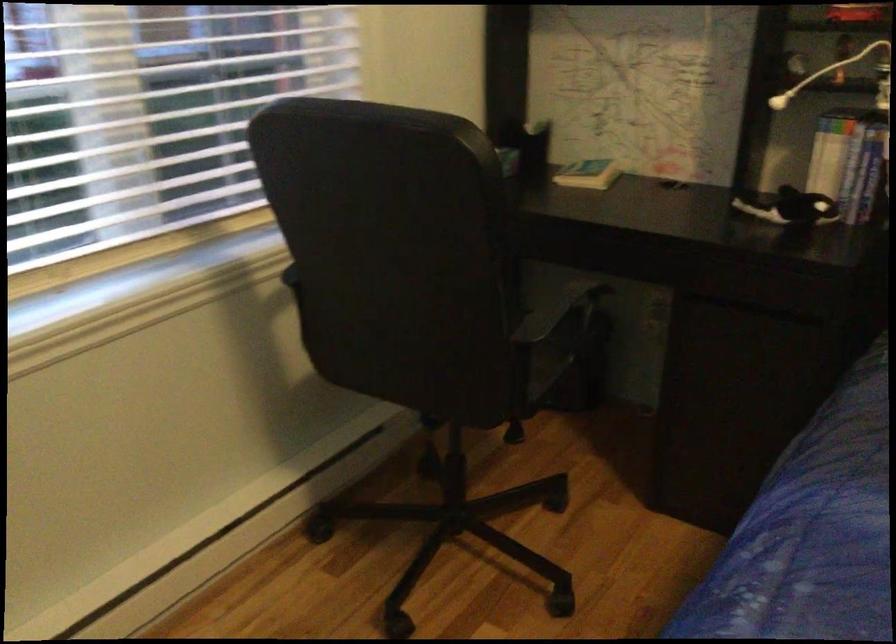
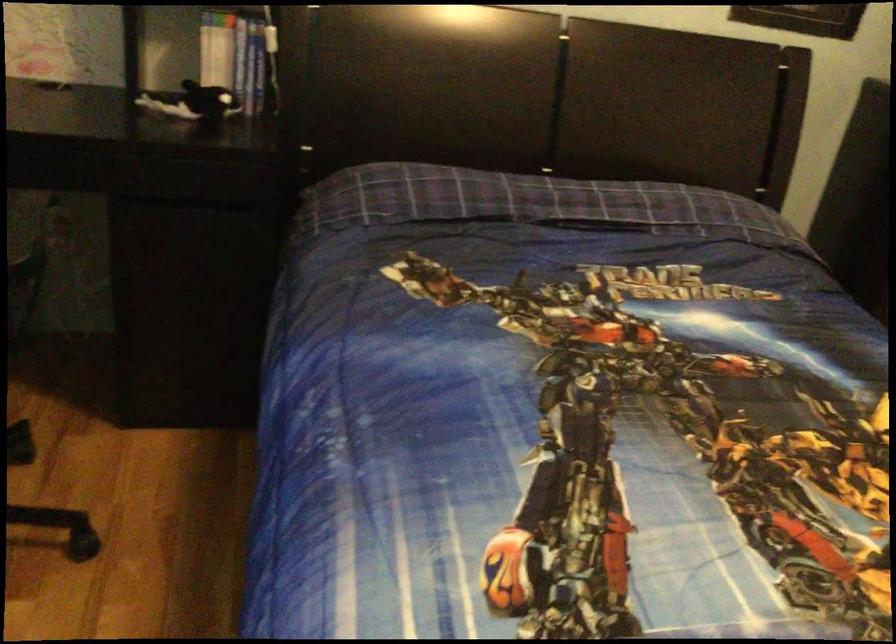
Question: How did the camera likely rotate?

Choices:
 (A) Left
 (B) Right
 (C) Up
 (D) Down

Answer: (B)